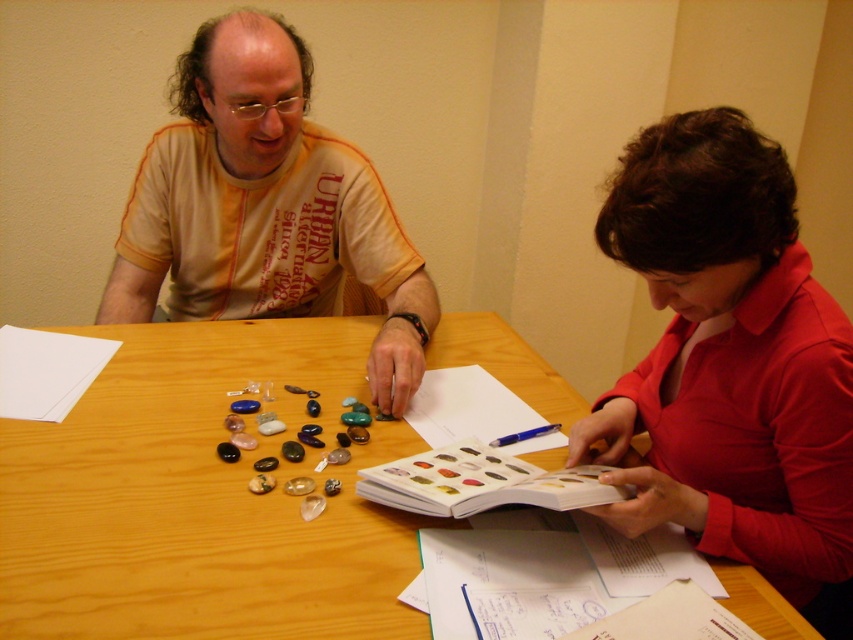
This screenshot has height=640, width=853. I want to click on matte red blouse at center, so click(x=730, y=364).

Between point (698, 481) and point (13, 332), which one is positioned behind?

The point (13, 332) is behind.

What do you see at coordinates (730, 364) in the screenshot? I see `matte red blouse at center` at bounding box center [730, 364].

This screenshot has height=640, width=853. I want to click on matte red blouse at center, so click(x=730, y=364).

Is matte red blouse at center further to the viewer compared to matte orange t-shirt at center?

No, matte red blouse at center is closer to the viewer.

Who is lower down, matte red blouse at center or matte orange t-shirt at center?

matte red blouse at center is lower down.

Does point (761, 512) come closer to viewer compared to point (421, 332)?

Yes, point (761, 512) is closer to viewer.

Where is `matte red blouse at center`? matte red blouse at center is located at coordinates (730, 364).

Between point (563, 493) and point (486, 412), which one is positioned behind?

The point (486, 412) is more distant.

Is point (456, 477) farther from camera compared to point (494, 416)?

No.

This screenshot has height=640, width=853. Find the location of `shiny plastic book at center`. shiny plastic book at center is located at coordinates (480, 483).